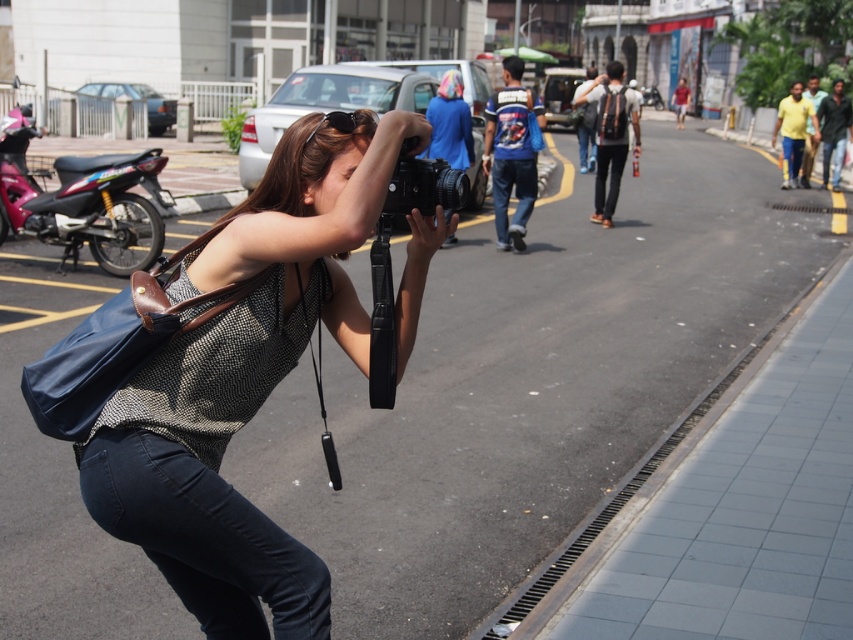
Does metallic glossy motorcycle at left appear on the right side of black matte camera at center?

No, metallic glossy motorcycle at left is not to the right of black matte camera at center.

Is point (155, 152) farther from camera compared to point (448, 166)?

That is True.

I want to click on metallic glossy motorcycle at left, so click(x=82, y=200).

Can you confirm if matte black camera at center is positioned to the left of black matte camera at center?

Correct, you'll find matte black camera at center to the left of black matte camera at center.

Who is positioned more to the left, matte black camera at center or black matte camera at center?

matte black camera at center

Find the location of `matte black camera at center`. matte black camera at center is located at coordinates (244, 381).

Is metallic glossy motorcycle at left shorter than black plastic sunglasses at center?

In fact, metallic glossy motorcycle at left may be taller than black plastic sunglasses at center.

Is metallic glossy motorcycle at left wider than black plastic sunglasses at center?

Yes, metallic glossy motorcycle at left is wider than black plastic sunglasses at center.

Who is more forward, (77, 157) or (352, 116)?

Point (352, 116) is more forward.

You are a GUI agent. You are given a task and a screenshot of the screen. Output one action in this format:
    pyautogui.click(x=<x>, y=<y>)
    Task: Click on the metallic glossy motorcycle at left
    
    Given the screenshot: What is the action you would take?
    pyautogui.click(x=82, y=200)